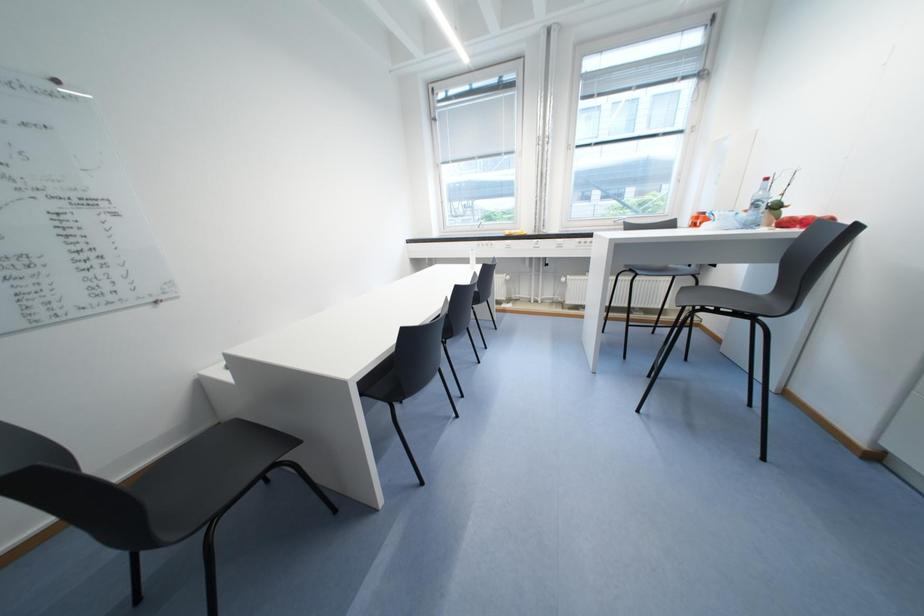
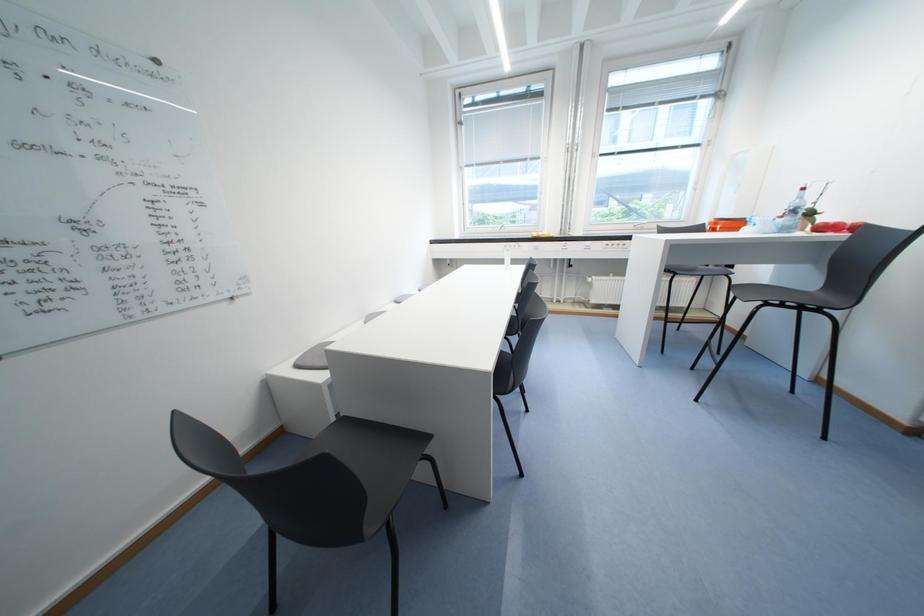
Question: What movement of the cameraman would produce the second image?

Choices:
 (A) Left
 (B) Right
 (C) Forward
 (D) Backward

Answer: (A)